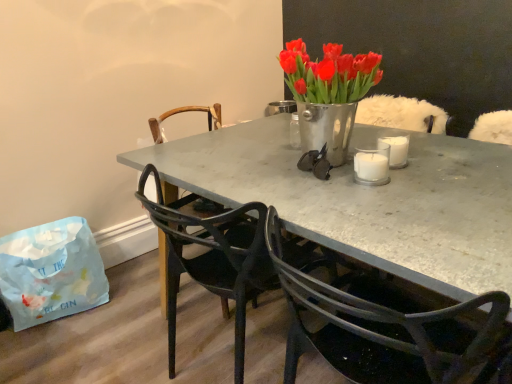
Question: Is metallic black glasses at center at the back of matte black chair at center, the second chair from the back?

Choices:
 (A) no
 (B) yes

Answer: (A)

Question: Considering the relative sizes of matte black chair at center, the second chair from the back, and metallic black glasses at center in the image provided, is matte black chair at center, the second chair from the back, wider than metallic black glasses at center?

Choices:
 (A) yes
 (B) no

Answer: (A)

Question: Are matte black chair at center, which is the second chair in front-to-back order, and metallic black glasses at center located far from each other?

Choices:
 (A) yes
 (B) no

Answer: (B)

Question: From a real-world perspective, is matte black chair at center, which is the second chair in front-to-back order, physically above metallic black glasses at center?

Choices:
 (A) yes
 (B) no

Answer: (B)

Question: From a real-world perspective, is matte black chair at center, the second chair from the back, beneath metallic black glasses at center?

Choices:
 (A) no
 (B) yes

Answer: (B)

Question: From the image's perspective, is metallic gray table at center positioned above or below matte black chair at center, the first chair when ordered from front to back?

Choices:
 (A) below
 (B) above

Answer: (B)

Question: In terms of width, does metallic gray table at center look wider or thinner when compared to matte black chair at center, which is the 3th chair from back to front?

Choices:
 (A) wide
 (B) thin

Answer: (A)

Question: From a real-world perspective, is metallic gray table at center above or below matte black chair at center, the first chair when ordered from front to back?

Choices:
 (A) below
 (B) above

Answer: (A)

Question: Would you say metallic gray table at center is to the left or to the right of matte black chair at center, the first chair when ordered from front to back, in the picture?

Choices:
 (A) left
 (B) right

Answer: (B)

Question: Relative to white glass candle at center, is metallic gray table at center in front or behind?

Choices:
 (A) front
 (B) behind

Answer: (A)

Question: Is metallic gray table at center taller or shorter than white glass candle at center?

Choices:
 (A) tall
 (B) short

Answer: (A)

Question: From a real-world perspective, is metallic gray table at center physically located above or below white glass candle at center?

Choices:
 (A) below
 (B) above

Answer: (A)

Question: Would you say metallic gray table at center is to the left or to the right of white glass candle at center in the picture?

Choices:
 (A) right
 (B) left

Answer: (B)

Question: From a real-world perspective, is white glass candle at center positioned above or below white paper bag at lower left?

Choices:
 (A) below
 (B) above

Answer: (B)

Question: Based on their positions, is white glass candle at center located to the left or right of white paper bag at lower left?

Choices:
 (A) right
 (B) left

Answer: (A)